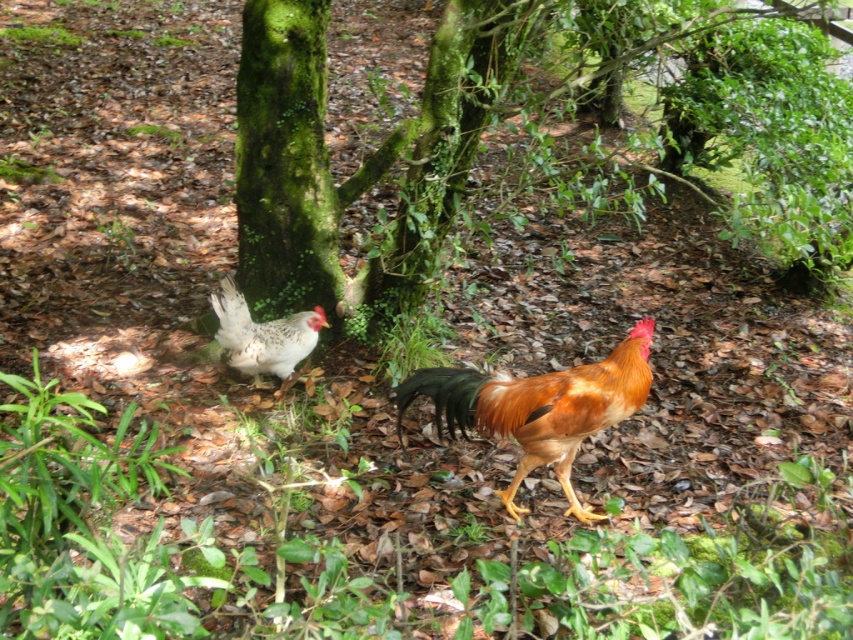
You are a hiker who wants to take a photo of the green mossy tree at center and the speckled feathered chicken at center. If you are standing to the left of both objects, which one would you see first when looking towards the right?

The speckled feathered chicken at center would be seen first because the green mossy tree at center is to its right, meaning the chicken is closer to your left position.

What is located at the point with coordinates (x=505, y=113) in the image?

The point at coordinates (x=505, y=113) is where the green mossy tree at center is located.

You are standing at the origin point in the image. There are two points marked in the scene. Which point is closer to you, point (440, 179) or point (523, 445)?

Point (523, 445) is closer to you because it is in front of point (440, 179).